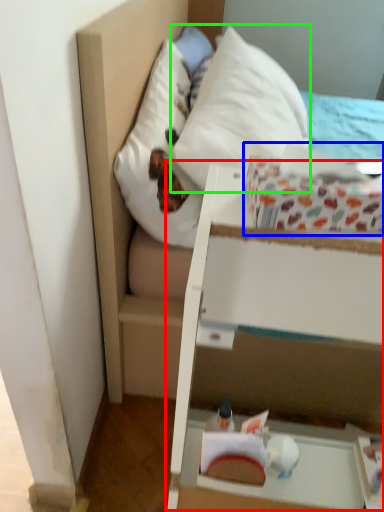
Question: Which object is positioned closest to vanity (highlighted by a red box)? Select from cardboard box (highlighted by a blue box) and pillow (highlighted by a green box).

Choices:
 (A) cardboard box
 (B) pillow

Answer: (A)